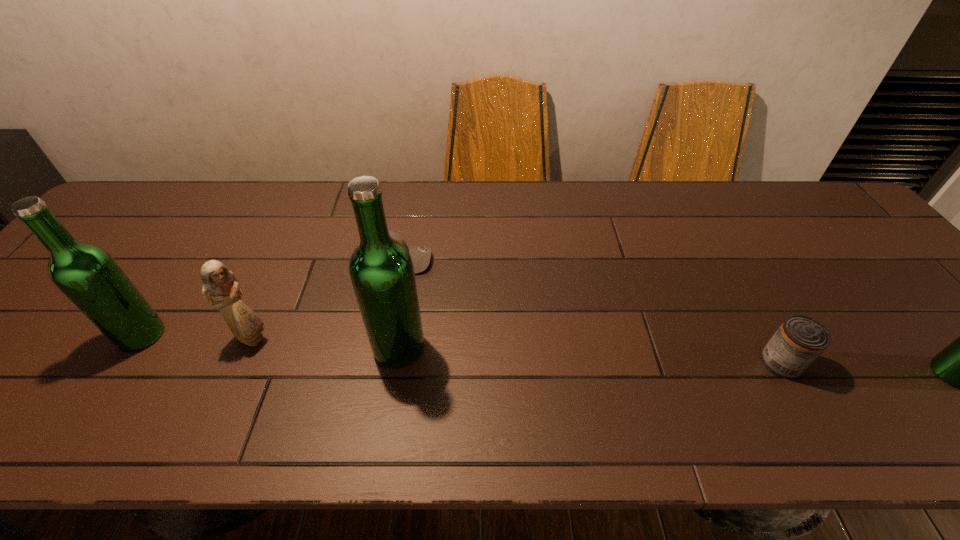
Where is `vacant space at the far right corner of the desktop`? vacant space at the far right corner of the desktop is located at coordinates (813, 221).

At what (x,y) coordinates should I click in order to perform the action: click on vacant space that's between the second beer bottle from right to left and the second tallest object. Please return your answer as a coordinate pair (x, y). The height and width of the screenshot is (540, 960). Looking at the image, I should click on (270, 341).

Image resolution: width=960 pixels, height=540 pixels. Find the location of `vacant region between the farthest object and the fifth shortest object`. vacant region between the farthest object and the fifth shortest object is located at coordinates (268, 298).

At what (x,y) coordinates should I click in order to perform the action: click on vacant space that's between the second beer bottle from left to right and the can. Please return your answer as a coordinate pair (x, y). The image size is (960, 540). Looking at the image, I should click on (590, 355).

At what (x,y) coordinates should I click in order to perform the action: click on unoccupied position between the fourth tallest object and the leftmost object. Please return your answer as a coordinate pair (x, y). Image resolution: width=960 pixels, height=540 pixels. Looking at the image, I should click on (197, 337).

The image size is (960, 540). I want to click on blank region between the figurine and the second beer bottle from right to left, so click(325, 343).

The height and width of the screenshot is (540, 960). Identify the location of free spot between the figurine and the can. (516, 350).

Identify the location of unoccupied area between the second beer bottle from left to right and the second object from left to right. The height and width of the screenshot is (540, 960). (325, 343).

Select which object is the fifth closest to the figurine. Please provide its 2D coordinates. Your answer should be formatted as a tuple, i.e. [(x, y)], where the tuple contains the x and y coordinates of a point satisfying the conditions above.

[(959, 364)]

Locate which object ranks second in proximity to the can. Please provide its 2D coordinates. Your answer should be formatted as a tuple, i.e. [(x, y)], where the tuple contains the x and y coordinates of a point satisfying the conditions above.

[(381, 270)]